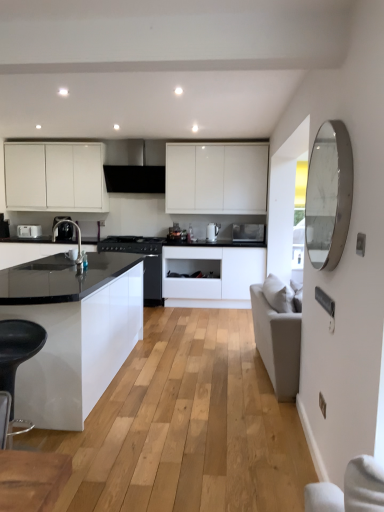
Question: From the image's perspective, relative to white matte cabinet at center, which ranks as the second cabinetry in left-to-right order, is black matte exhaust hood at upper center above or below?

Choices:
 (A) below
 (B) above

Answer: (B)

Question: Is black matte exhaust hood at upper center taller or shorter than white matte cabinet at center, positioned as the second cabinetry in top-to-bottom order?

Choices:
 (A) tall
 (B) short

Answer: (B)

Question: Which object is positioned farthest from the satin black coffee machine at left?

Choices:
 (A) black matte stove at center, arranged as the 3th appliance when viewed from the right
 (B) black plastic bar stool at lower left
 (C) matte black sink at center
 (D) white glossy kettle at center, the 2th appliance in the right-to-left sequence
 (E) silver/metallic mirror at right

Answer: (D)

Question: Which is nearer to the matte black sink at center?

Choices:
 (A) white matte cabinet at center, which ranks as the second cabinetry in left-to-right order
 (B) white matte cabinet at upper left, marked as the 2th cabinetry in a right-to-left arrangement
 (C) white glossy kettle at center, the second appliance viewed from the left
 (D) satin black coffee machine at left
 (E) metallic silver microwave at center, the 3th appliance when ordered from left to right

Answer: (D)